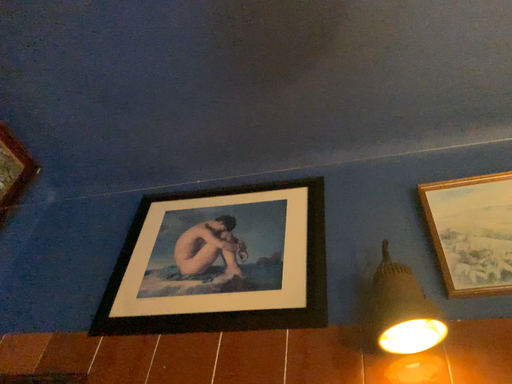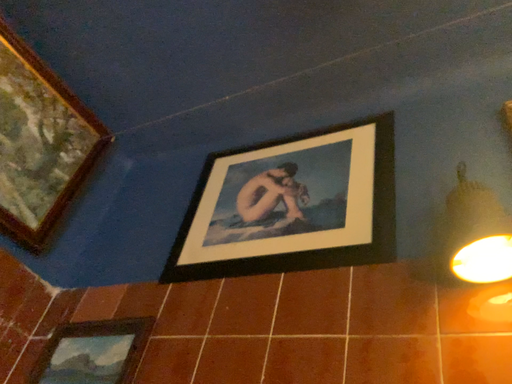
Question: Which way did the camera rotate in the video?

Choices:
 (A) rotated left
 (B) rotated right

Answer: (A)